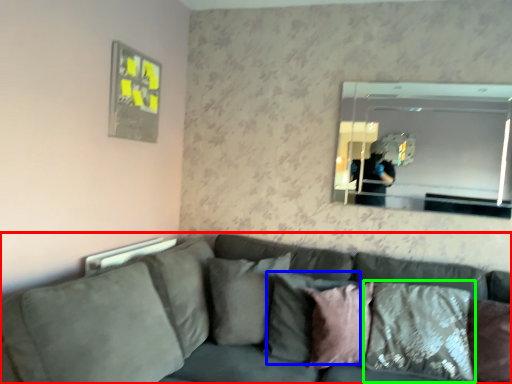
Question: Based on their relative distances, which object is farther from studio couch (highlighted by a red box)? Choose from pillow (highlighted by a blue box) and pillow (highlighted by a green box).

Choices:
 (A) pillow
 (B) pillow

Answer: (B)